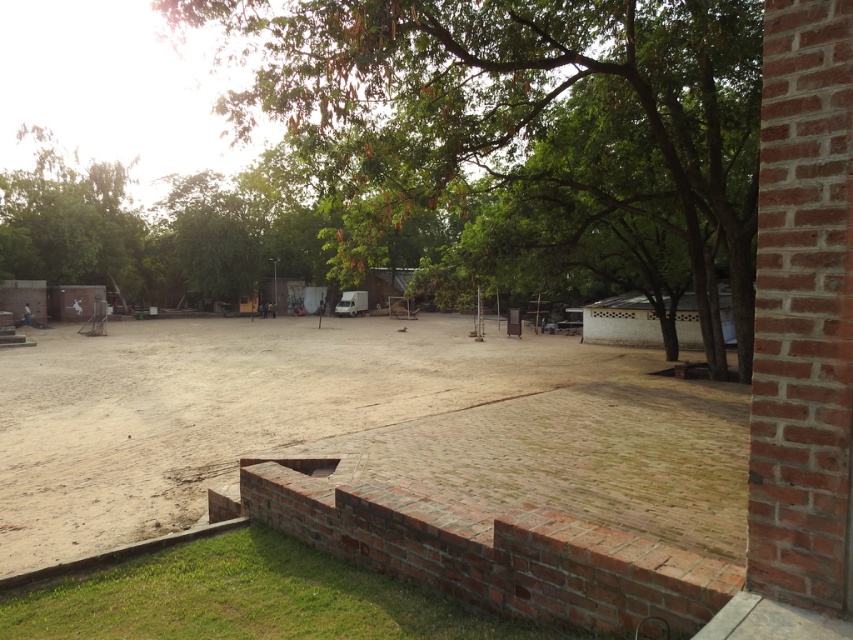
You are standing at the brick wall in the foreground and want to walk to the brown dirt field at center. Which direction should you head relative to the green leafy tree at center?

Since the green leafy tree at center is to the right of the brown dirt field at center, you should head to the left of the green leafy tree at center to reach the brown dirt field at center.